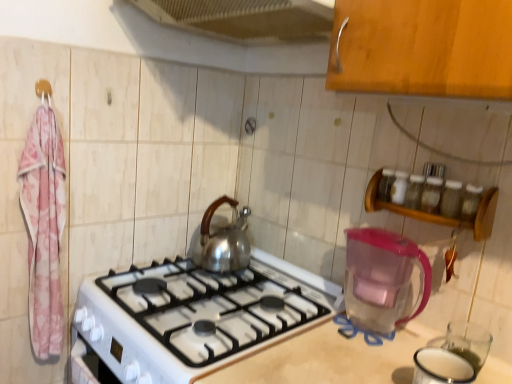
Question: From a real-world perspective, is white glossy oven at lower left positioned under silver metallic kettle at center based on gravity?

Choices:
 (A) yes
 (B) no

Answer: (A)

Question: Is white glossy oven at lower left taller than silver metallic kettle at center?

Choices:
 (A) no
 (B) yes

Answer: (B)

Question: Is white glossy oven at lower left bigger than silver metallic kettle at center?

Choices:
 (A) no
 (B) yes

Answer: (A)

Question: Would you say silver metallic kettle at center is part of white glossy oven at lower left's contents?

Choices:
 (A) yes
 (B) no

Answer: (B)

Question: Is white glossy oven at lower left further to the viewer compared to silver metallic kettle at center?

Choices:
 (A) no
 (B) yes

Answer: (A)

Question: Would you say white glossy oven at lower left is outside silver metallic kettle at center?

Choices:
 (A) yes
 (B) no

Answer: (A)

Question: Is silver metallic kettle at center at the back of pink fabric hanger at upper left?

Choices:
 (A) no
 (B) yes

Answer: (A)

Question: Is pink fabric hanger at upper left wider than silver metallic kettle at center?

Choices:
 (A) yes
 (B) no

Answer: (B)

Question: Is pink fabric hanger at upper left bigger than silver metallic kettle at center?

Choices:
 (A) yes
 (B) no

Answer: (B)

Question: Does pink fabric hanger at upper left appear on the right side of silver metallic kettle at center?

Choices:
 (A) no
 (B) yes

Answer: (A)

Question: From the image's perspective, is pink fabric hanger at upper left beneath silver metallic kettle at center?

Choices:
 (A) yes
 (B) no

Answer: (B)

Question: Would you say silver metallic kettle at center is part of pink fabric hanger at upper left's contents?

Choices:
 (A) no
 (B) yes

Answer: (A)

Question: From the image's perspective, is metallic mesh at upper center on top of transparent plastic pitcher at lower right?

Choices:
 (A) yes
 (B) no

Answer: (A)